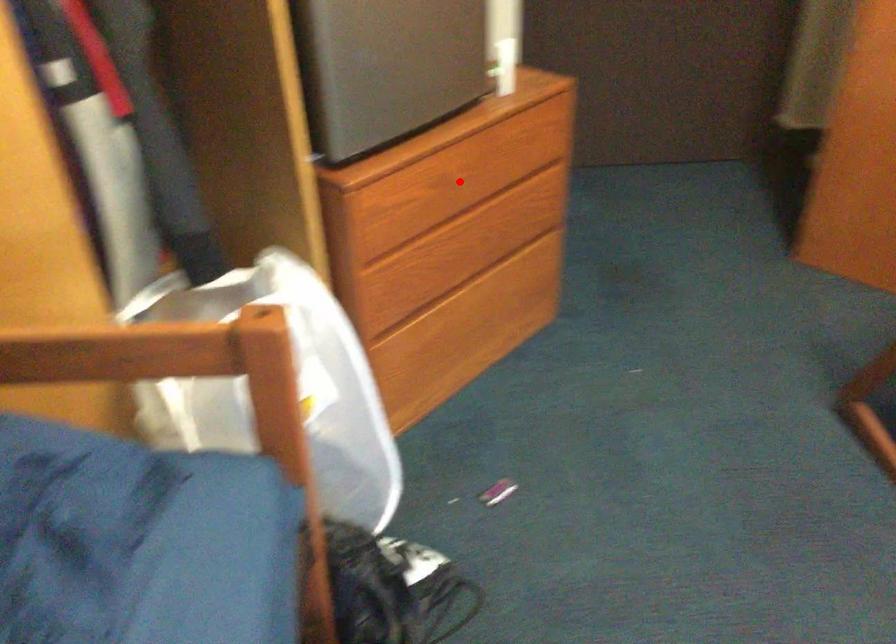
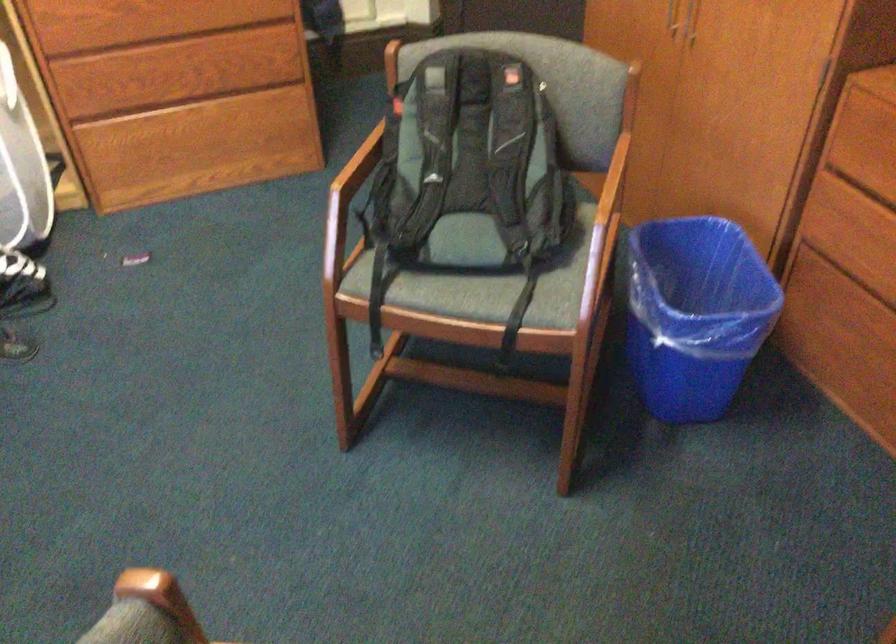
Find the pixel in the second image that matches the highlighted location in the first image.

(160, 20)